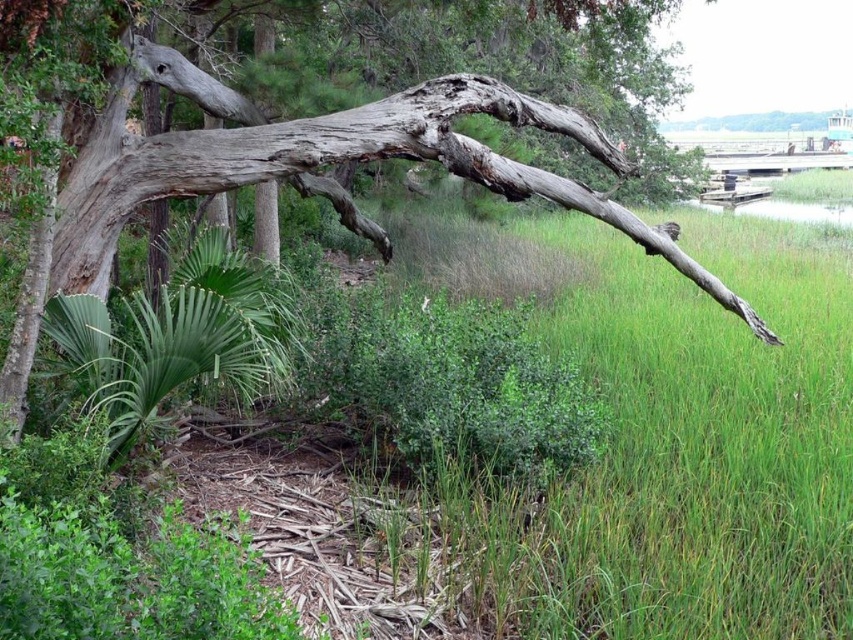
You are a botanist examining the gray rough bark tree at upper left and the green leafy plant at lower left in the image. Which of these two has a bigger size?

The gray rough bark tree at upper left has a larger size compared to the green leafy plant at lower left.

You are standing in a coastal marshland scene and want to move from the large fallen tree trunk on the left to the waterline in the foreground. There are two points marked on your path. Which point, point (244, 157) or point (239, 316), is closer to you as you walk towards the waterline?

Point (244, 157) is closer to you as you walk towards the waterline because it is further to the viewer compared to point (239, 316).